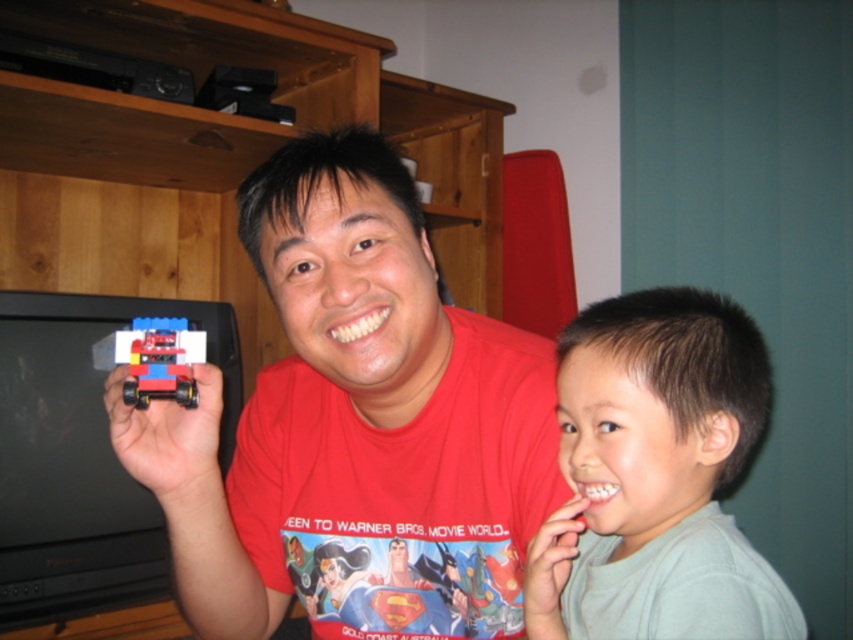
Question: Which point is closer to the camera?

Choices:
 (A) matte plastic toy car at left
 (B) red plastic car at center
 (C) light gray cotton shirt at right

Answer: (C)

Question: Is light gray cotton shirt at right thinner than red plastic car at center?

Choices:
 (A) yes
 (B) no

Answer: (B)

Question: Is matte plastic toy car at left thinner than light gray cotton shirt at right?

Choices:
 (A) no
 (B) yes

Answer: (A)

Question: Which of the following is the closest to the observer?

Choices:
 (A) (132, 388)
 (B) (639, 552)

Answer: (B)

Question: Which object is farther from the camera taking this photo?

Choices:
 (A) red plastic car at center
 (B) matte plastic toy car at left
 (C) light gray cotton shirt at right

Answer: (B)

Question: Considering the relative positions of light gray cotton shirt at right and red plastic car at center in the image provided, where is light gray cotton shirt at right located with respect to red plastic car at center?

Choices:
 (A) left
 (B) right

Answer: (B)